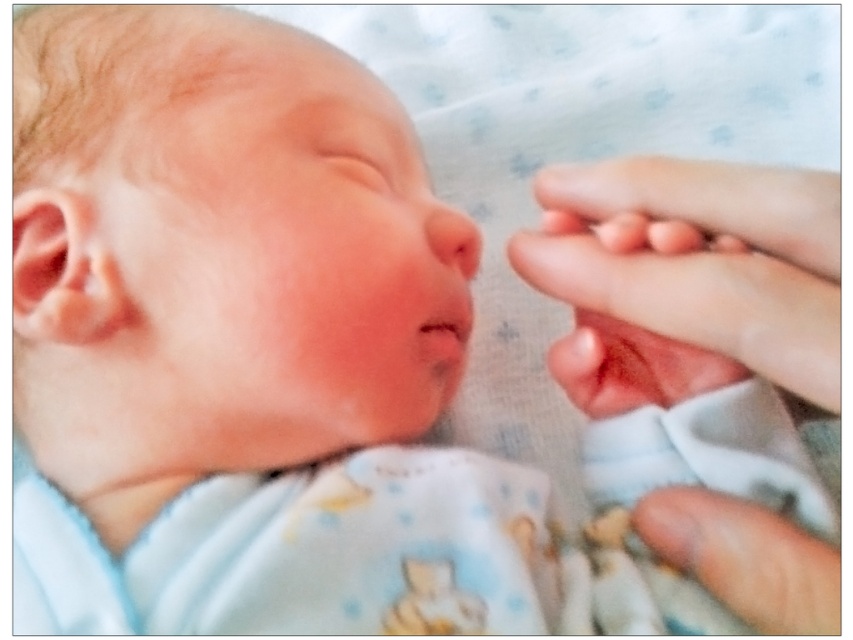
Looking at this image, can you confirm if smooth flesh nose at center is positioned below pink smooth skin at center?

Actually, smooth flesh nose at center is above pink smooth skin at center.

Is smooth flesh nose at center closer to the viewer compared to pink smooth skin at center?

No.

Is point (465, 241) farther from viewer compared to point (421, 337)?

Yes, it is behind point (421, 337).

Identify the location of smooth flesh nose at center. The height and width of the screenshot is (640, 853). (451, 237).

Who is positioned more to the right, pink flesh-toned hand at right or smooth flesh nose at center?

pink flesh-toned hand at right is more to the right.

Does pink flesh-toned hand at right appear on the right side of smooth flesh nose at center?

Indeed, pink flesh-toned hand at right is positioned on the right side of smooth flesh nose at center.

Is point (786, 275) farther from camera compared to point (432, 234)?

No, (786, 275) is closer to viewer.

The image size is (853, 640). Identify the location of pink flesh-toned hand at right. (706, 260).

Can you confirm if pink flesh-toned hand at right is positioned above pink smooth skin at center?

Correct, pink flesh-toned hand at right is located above pink smooth skin at center.

Is point (689, 257) positioned behind point (422, 340)?

No, (689, 257) is closer to viewer.

Find the location of `pink flesh-toned hand at right`. pink flesh-toned hand at right is located at coordinates (706, 260).